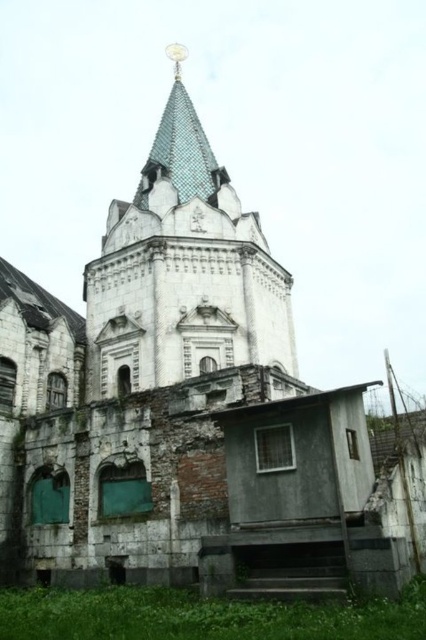
Which is more to the right, white stone tower at center or blue tiled spire at upper center?

white stone tower at center is more to the right.

Looking at this image, is white stone tower at center shorter than blue tiled spire at upper center?

No.

Where is `white stone tower at center`? The width and height of the screenshot is (426, 640). white stone tower at center is located at coordinates (183, 269).

The height and width of the screenshot is (640, 426). I want to click on white stone tower at center, so click(x=183, y=269).